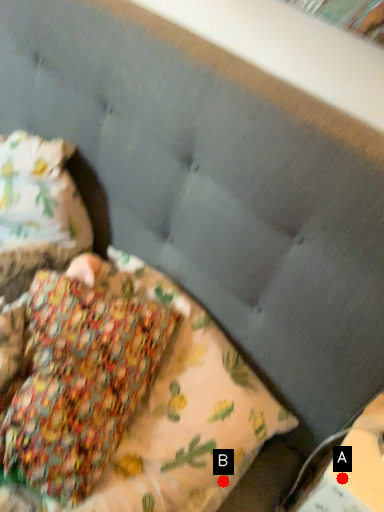
Question: Two points are circled on the image, labeled by A and B beside each circle. Among these points, which one is farthest from the camera?

Choices:
 (A) A is further
 (B) B is further

Answer: (B)